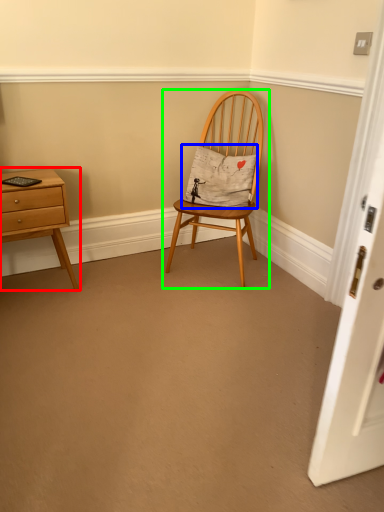
Question: Based on their relative distances, which object is nearer to nightstand (highlighted by a red box)? Choose from pillow (highlighted by a blue box) and chair (highlighted by a green box).

Choices:
 (A) pillow
 (B) chair

Answer: (B)